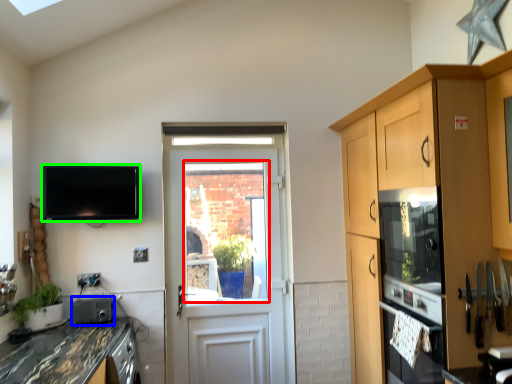
Question: Considering the real-world distances, which object is farthest from window screen (highlighted by a red box)? appliance (highlighted by a blue box) or television (highlighted by a green box)?

Choices:
 (A) appliance
 (B) television

Answer: (A)